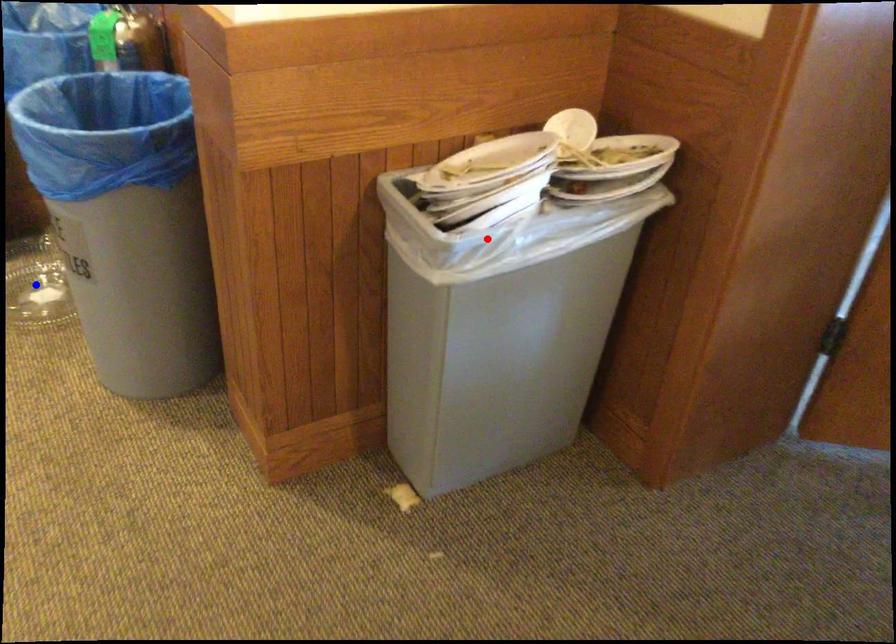
Question: In the image, two points are highlighted. Which point is nearer to the camera? Reply with the corresponding letter.

Choices:
 (A) blue point
 (B) red point

Answer: (B)